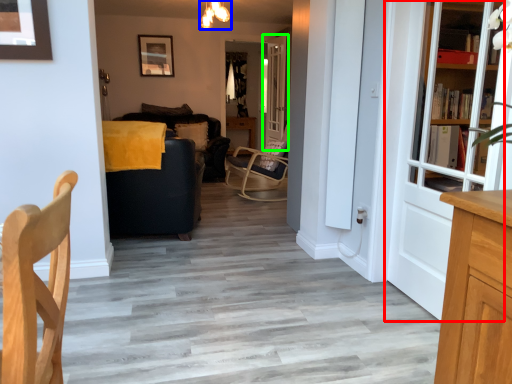
Question: Which object is positioned farthest from door (highlighted by a red box)? Select from light fixture (highlighted by a blue box) and door (highlighted by a green box).

Choices:
 (A) light fixture
 (B) door

Answer: (B)